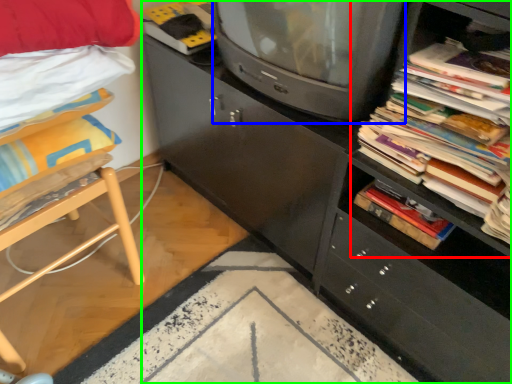
Question: Which object is the farthest from shelf (highlighted by a red box)? Choose among these: television (highlighted by a blue box) or cabinetry (highlighted by a green box).

Choices:
 (A) television
 (B) cabinetry

Answer: (B)